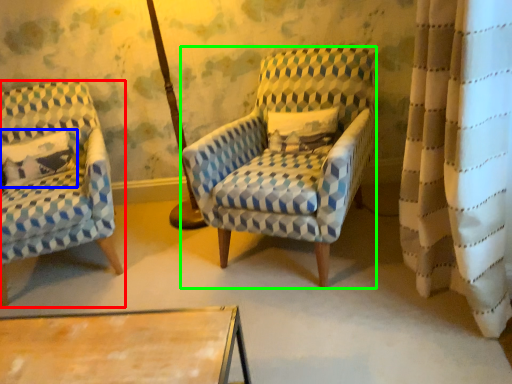
Question: Estimate the real-world distances between objects in this image. Which object is closer to chair (highlighted by a red box), pillow (highlighted by a blue box) or chair (highlighted by a green box)?

Choices:
 (A) pillow
 (B) chair

Answer: (A)